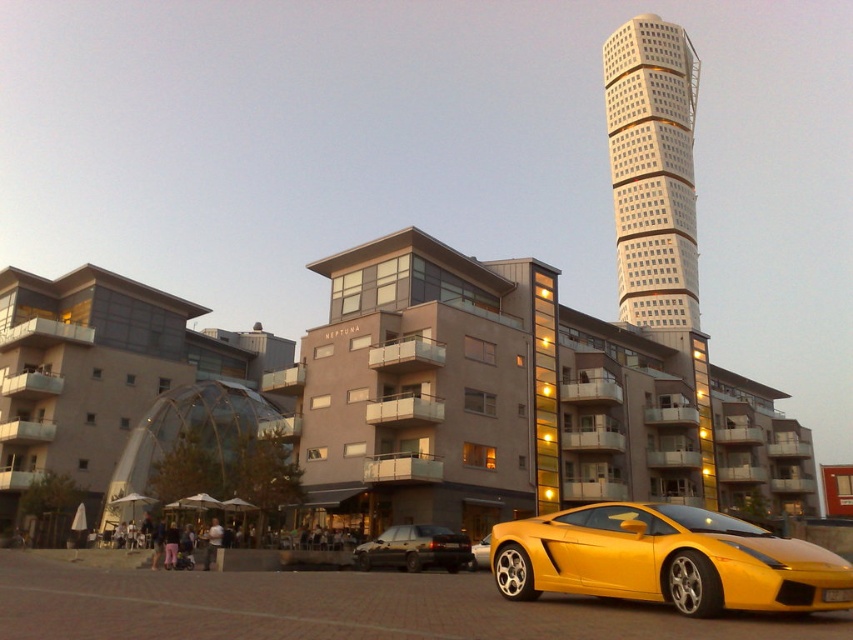
Can you confirm if white glass tower at upper center is shorter than yellow matte sports car at lower center?

No.

Does white glass tower at upper center appear over yellow matte sports car at lower center?

Correct, white glass tower at upper center is located above yellow matte sports car at lower center.

Who is more distant from viewer, (621,204) or (486,538)?

The point (621,204) is behind.

Where is `white glass tower at upper center`? white glass tower at upper center is located at coordinates (653, 170).

Between white glass tower at upper center and matte black sedan at center, which one is positioned lower?

matte black sedan at center is below.

Does point (683, 125) come farther from viewer compared to point (421, 536)?

That is True.

Does point (692, 100) come farther from viewer compared to point (457, 566)?

Yes.

This screenshot has height=640, width=853. What are the coordinates of `white glass tower at upper center` in the screenshot? It's located at (653, 170).

Can you confirm if metallic yellow sports car at lower right is smaller than matte black sedan at center?

Actually, metallic yellow sports car at lower right might be larger than matte black sedan at center.

Does point (695, 525) come in front of point (448, 536)?

Yes.

This screenshot has height=640, width=853. Find the location of `metallic yellow sports car at lower right`. metallic yellow sports car at lower right is located at coordinates [666, 561].